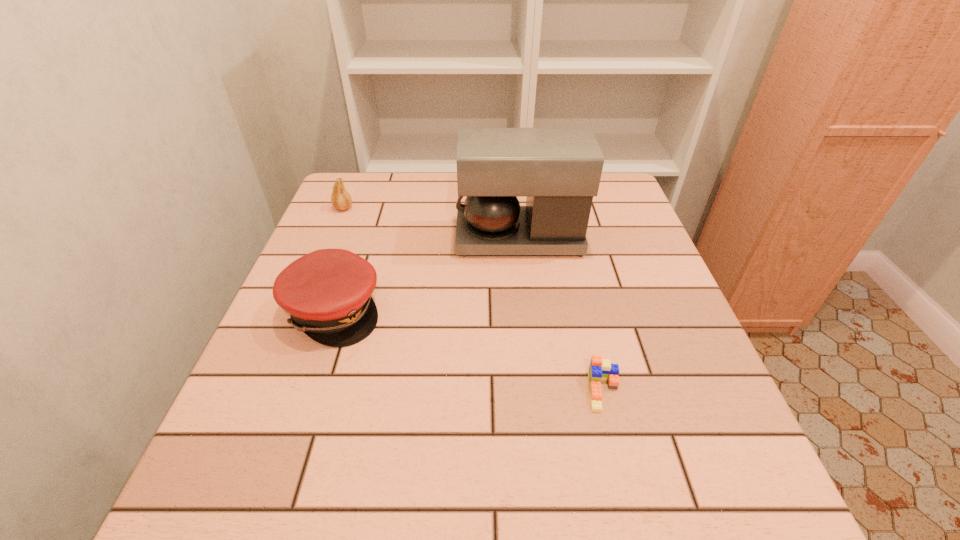
Where is `vacant region located on the right of the farthest object`? The width and height of the screenshot is (960, 540). vacant region located on the right of the farthest object is located at coordinates (488, 208).

At what (x,y) coordinates should I click in order to perform the action: click on vacant point located 0.360m on the left of the nearest object. Please return your answer as a coordinate pair (x, y). Image resolution: width=960 pixels, height=540 pixels. Looking at the image, I should click on (384, 392).

Locate an element on the screen. object present at the far edge is located at coordinates (340, 199).

Identify the location of cap situated at the left edge. (327, 293).

You are a GUI agent. You are given a task and a screenshot of the screen. Output one action in this format:
    pyautogui.click(x=<x>, y=<y>)
    Task: Click on the pear situated at the left edge
    The height and width of the screenshot is (540, 960).
    Given the screenshot: What is the action you would take?
    pyautogui.click(x=340, y=199)

What are the coordinates of `object situated at the far left corner` in the screenshot? It's located at (340, 199).

Where is `vacant space at the far edge`? This screenshot has width=960, height=540. vacant space at the far edge is located at coordinates (450, 185).

This screenshot has width=960, height=540. What are the coordinates of `vacant point at the near edge` in the screenshot? It's located at (321, 528).

Where is `blank area at the right edge`? Image resolution: width=960 pixels, height=540 pixels. blank area at the right edge is located at coordinates (700, 360).

Identify the location of vacant region at the near left corner of the desktop. This screenshot has height=540, width=960. (261, 478).